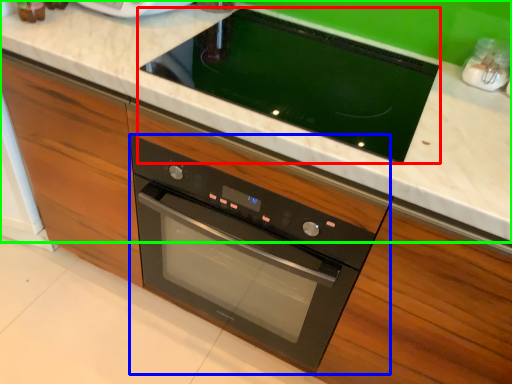
Question: Estimate the real-world distances between objects in this image. Which object is farther from home appliance (highlighted by a red box), oven (highlighted by a blue box) or countertop (highlighted by a green box)?

Choices:
 (A) oven
 (B) countertop

Answer: (A)